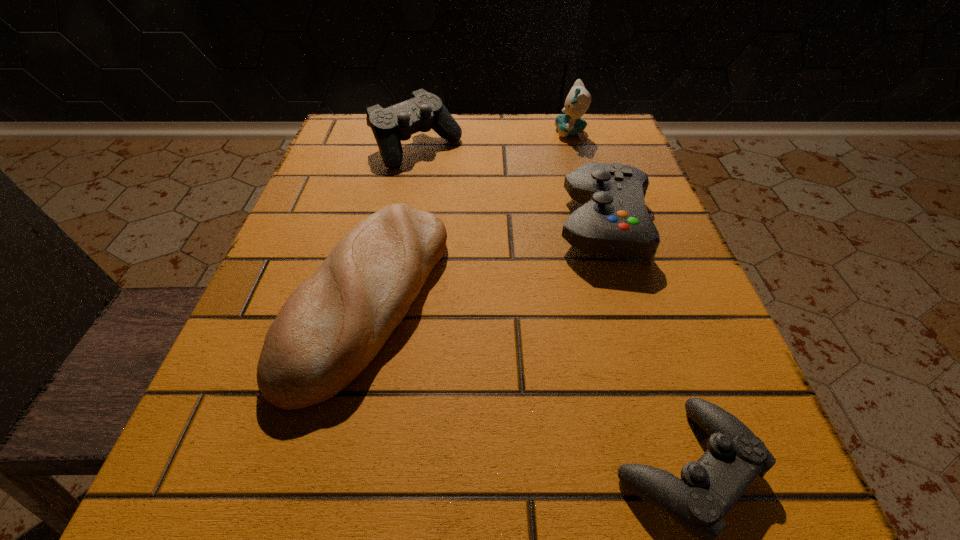
Select which object appears as the third closest to the second nearest control. Please provide its 2D coordinates. Your answer should be formatted as a tuple, i.e. [(x, y)], where the tuple contains the x and y coordinates of a point satisfying the conditions above.

[(330, 328)]

Identify which control is the second nearest to the shortest control. Please provide its 2D coordinates. Your answer should be formatted as a tuple, i.e. [(x, y)], where the tuple contains the x and y coordinates of a point satisfying the conditions above.

[(424, 111)]

Identify which control is the third nearest to the bread. Please provide its 2D coordinates. Your answer should be formatted as a tuple, i.e. [(x, y)], where the tuple contains the x and y coordinates of a point satisfying the conditions above.

[(708, 489)]

Where is `free space that satisfies the following two spatial constraints: 1. on the face of the tallest object; 2. on the front side of the leftmost control`? The width and height of the screenshot is (960, 540). free space that satisfies the following two spatial constraints: 1. on the face of the tallest object; 2. on the front side of the leftmost control is located at coordinates (575, 147).

The height and width of the screenshot is (540, 960). I want to click on vacant space that satisfies the following two spatial constraints: 1. on the face of the tallest object; 2. on the back side of the second nearest control, so click(x=597, y=226).

Find the location of a particular element. Image resolution: width=960 pixels, height=540 pixels. free spot that satisfies the following two spatial constraints: 1. on the face of the kitten; 2. on the front side of the leftmost control is located at coordinates pyautogui.click(x=575, y=147).

At what (x,y) coordinates should I click in order to perform the action: click on vacant space that satisfies the following two spatial constraints: 1. on the face of the tallest object; 2. on the left side of the second farthest control. Please return your answer as a coordinate pair (x, y). Image resolution: width=960 pixels, height=540 pixels. Looking at the image, I should click on (597, 226).